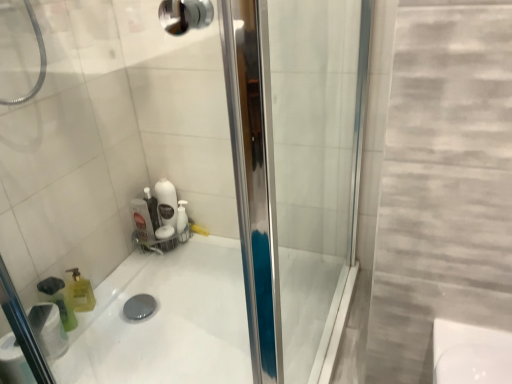
Question: Is the surface of white glossy bath at center in direct contact with white matte toilet paper at lower left?

Choices:
 (A) no
 (B) yes

Answer: (A)

Question: From a real-world perspective, is white glossy bath at center on white matte toilet paper at lower left?

Choices:
 (A) yes
 (B) no

Answer: (B)

Question: Is white glossy bath at center taller than white matte toilet paper at lower left?

Choices:
 (A) no
 (B) yes

Answer: (A)

Question: Is white glossy bath at center bigger than white matte toilet paper at lower left?

Choices:
 (A) no
 (B) yes

Answer: (B)

Question: From a real-world perspective, is white glossy bath at center below white matte toilet paper at lower left?

Choices:
 (A) no
 (B) yes

Answer: (B)

Question: Does white glossy bath at center come behind white matte toilet paper at lower left?

Choices:
 (A) no
 (B) yes

Answer: (A)

Question: Is translucent green bottle at lower left aimed at white glossy bath at center?

Choices:
 (A) yes
 (B) no

Answer: (B)

Question: From a real-world perspective, does translucent green bottle at lower left sit lower than white glossy bath at center?

Choices:
 (A) yes
 (B) no

Answer: (B)

Question: Is translucent green bottle at lower left at the left side of white glossy bath at center?

Choices:
 (A) yes
 (B) no

Answer: (A)

Question: Does translucent green bottle at lower left have a greater height compared to white glossy bath at center?

Choices:
 (A) no
 (B) yes

Answer: (B)

Question: Does translucent green bottle at lower left have a greater width compared to white glossy bath at center?

Choices:
 (A) no
 (B) yes

Answer: (A)

Question: Is translucent green bottle at lower left not inside white glossy bath at center?

Choices:
 (A) no
 (B) yes

Answer: (B)

Question: Is the depth of white matte toilet paper at lower left greater than that of white glossy bath at center?

Choices:
 (A) no
 (B) yes

Answer: (B)